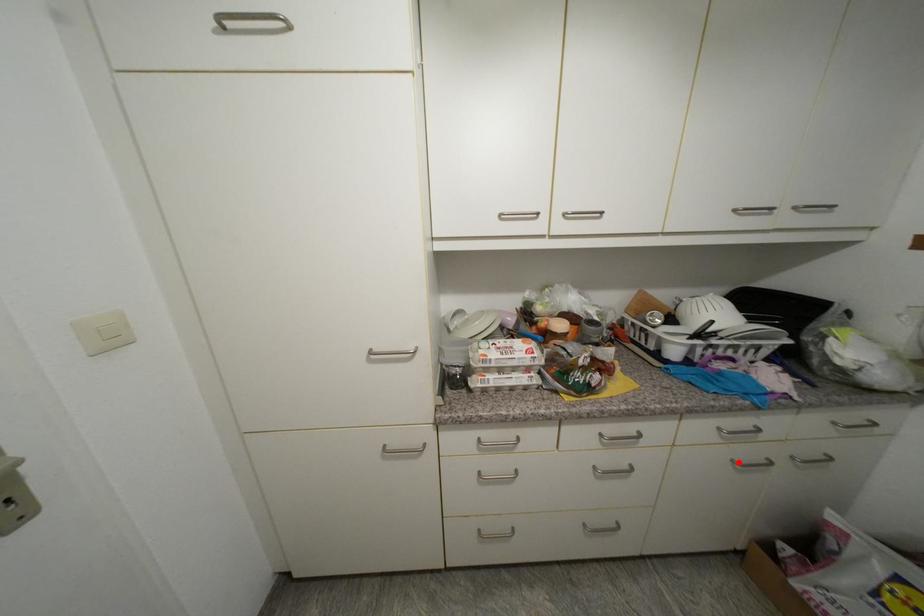
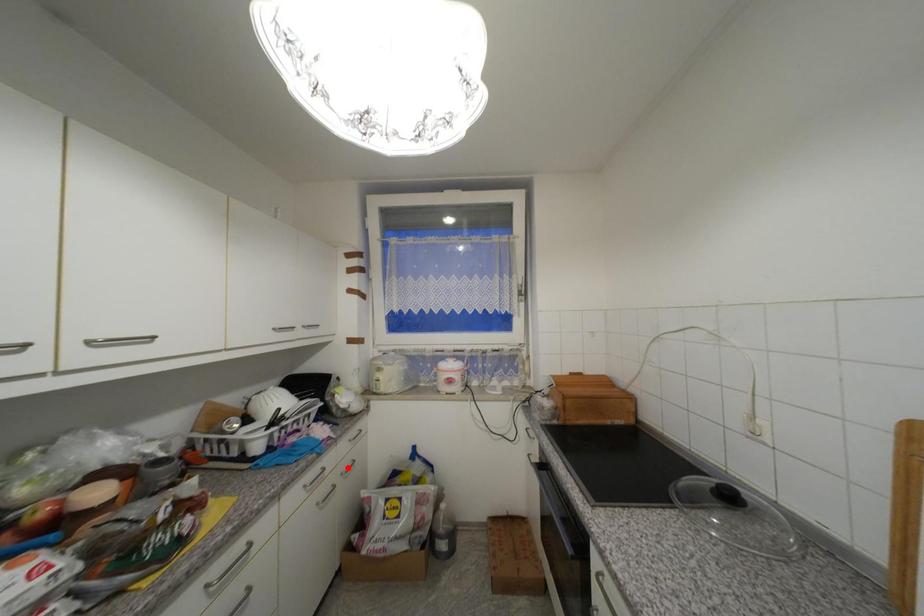
I am providing you with two images of the same scene from different viewpoints. A red point is marked on the first image and another point is marked on the second image. Do the highlighted points in image1 and image2 indicate the same real-world spot?

No